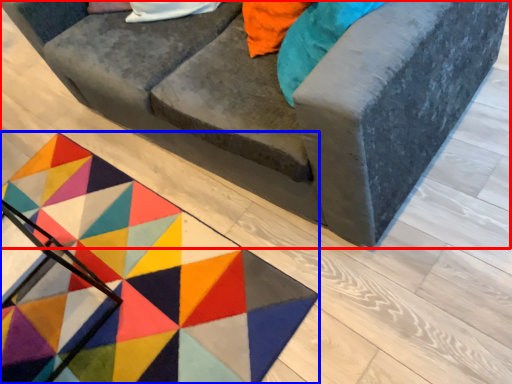
Question: Which object appears closest to the camera in this image, studio couch (highlighted by a red box) or mat (highlighted by a blue box)?

Choices:
 (A) studio couch
 (B) mat

Answer: (A)